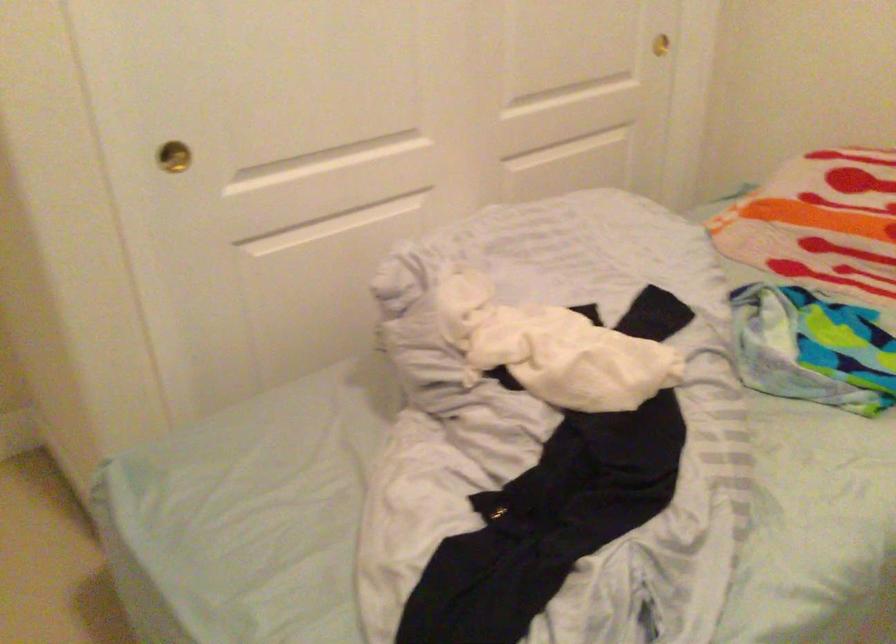
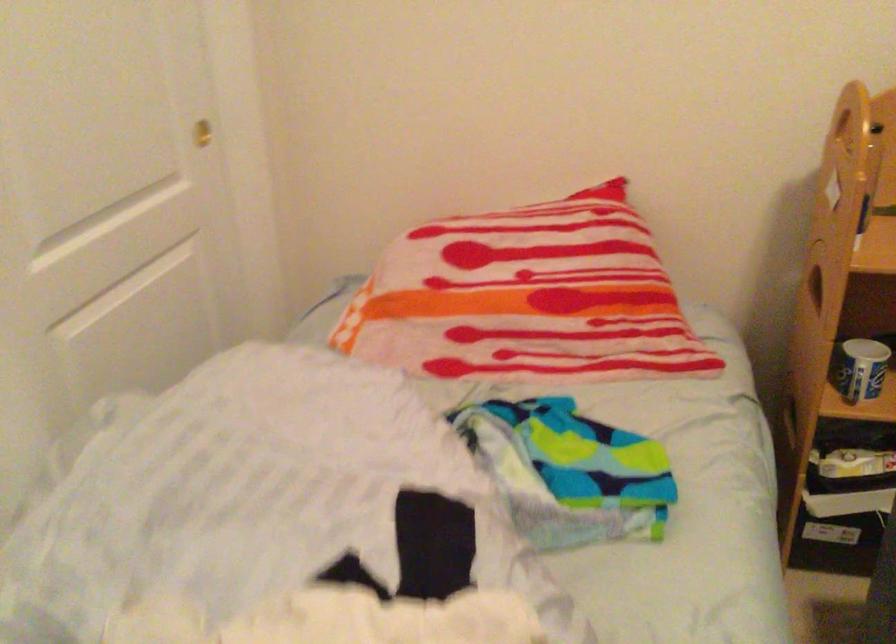
Question: The camera is either moving clockwise (left) or counter-clockwise (right) around the object. The first image is from the beginning of the video and the second image is from the end. Is the camera moving left or right when shooting the video?

Choices:
 (A) Left
 (B) Right

Answer: (A)